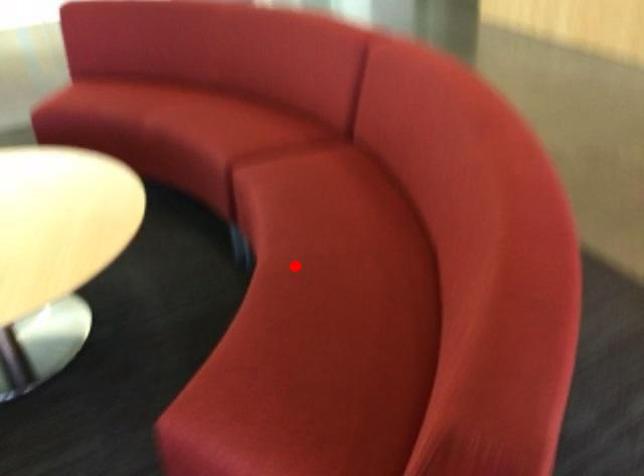
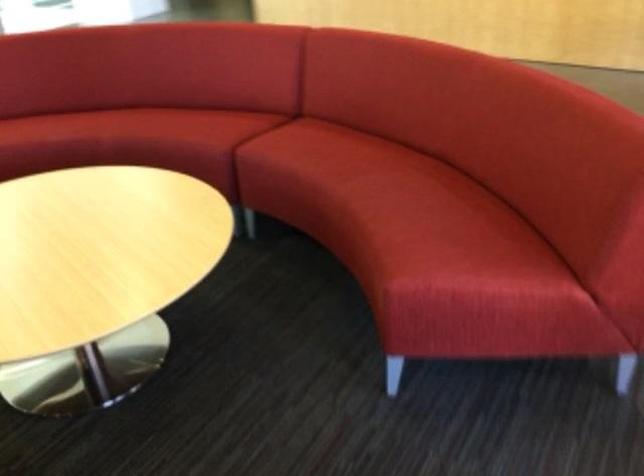
Question: I am providing you with two images of the same scene from different viewpoints. A red point is marked on the first image. Is the red point's position out of view in image 2?

Choices:
 (A) Yes
 (B) No

Answer: (B)